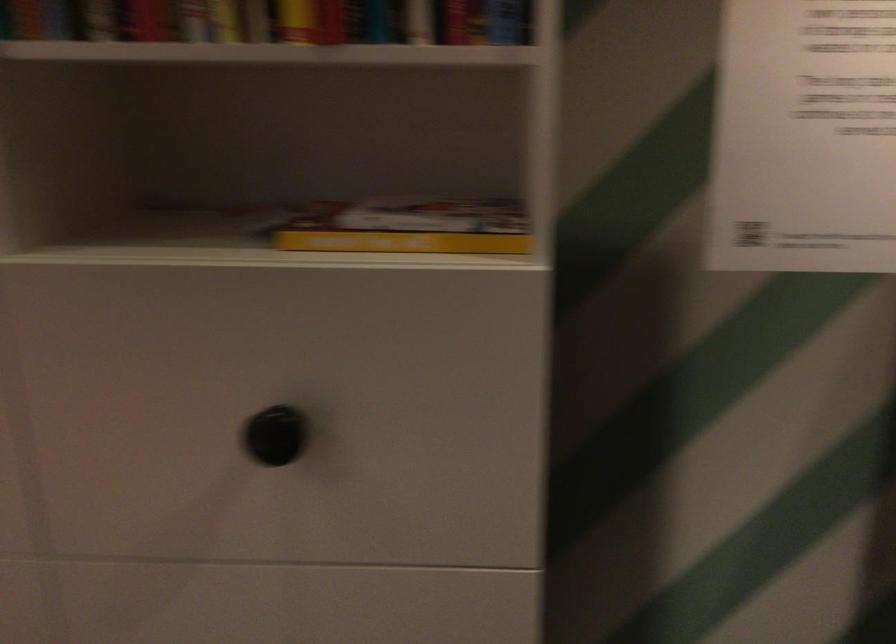
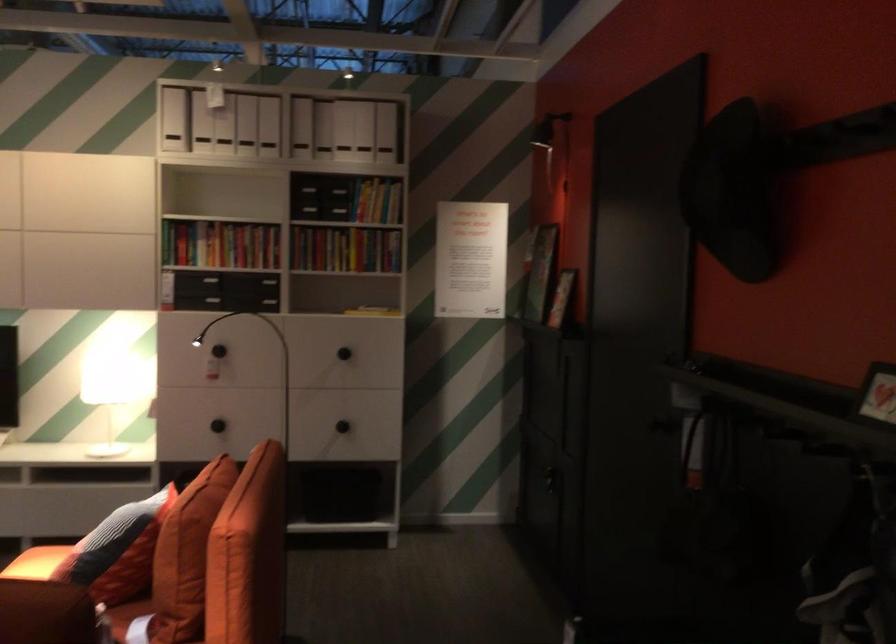
In the second image, find the point that corresponds to [333,471] in the first image.

(343, 353)